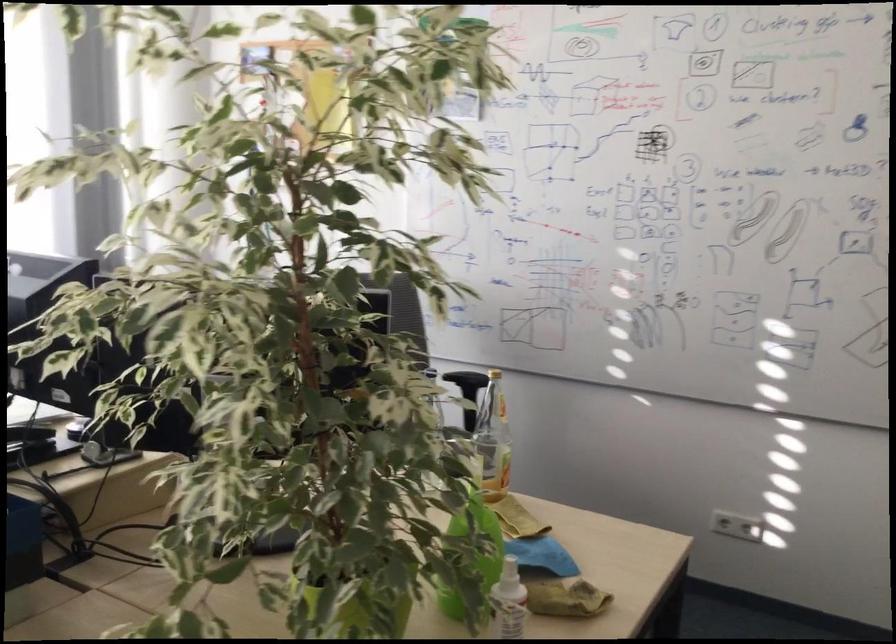
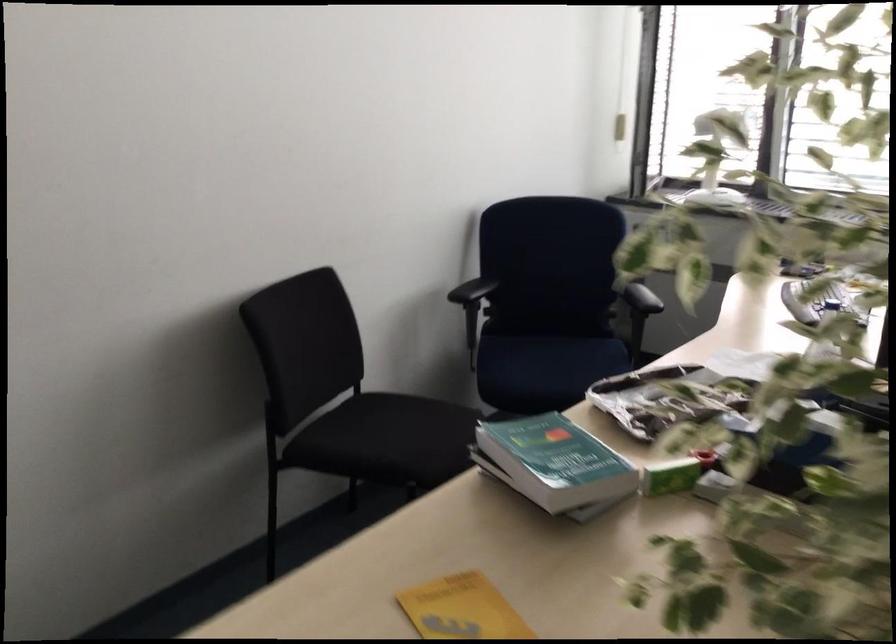
The point at (289, 406) is marked in the first image. Where is the corresponding point in the second image?

(847, 480)